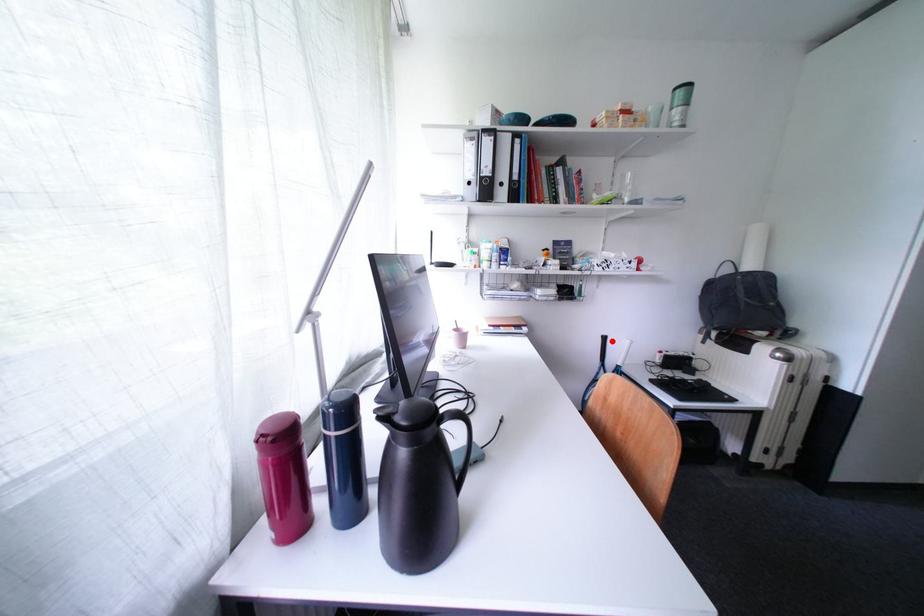
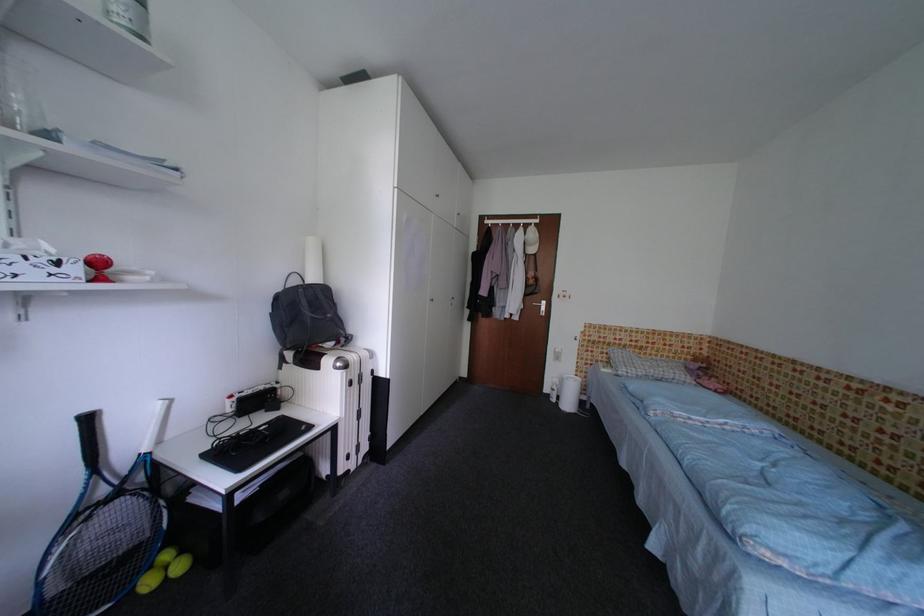
Locate, in the second image, the point that corresponds to the highlighted location in the first image.

(98, 422)